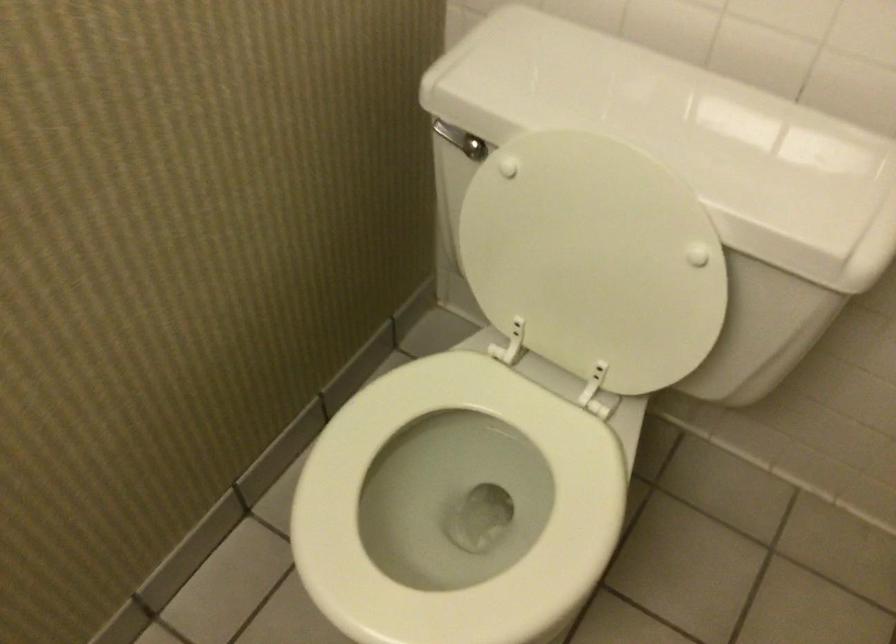
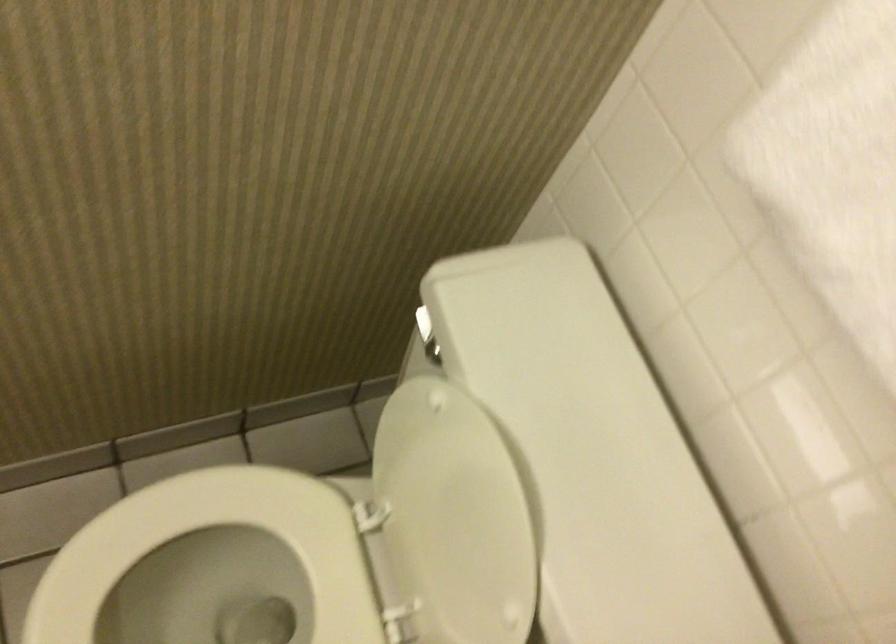
Find the pixel in the second image that matches the point at 591,245 in the first image.

(453, 518)